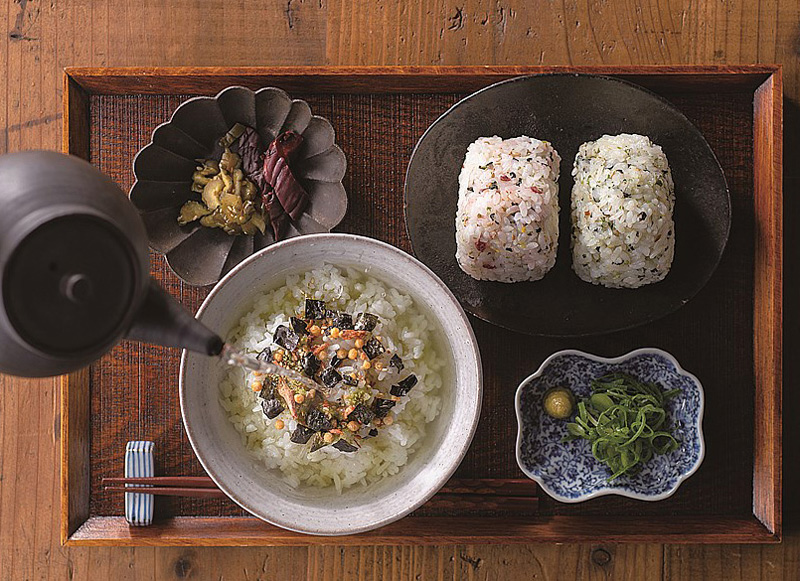
What are the coordinates of `tea pot` in the screenshot? It's located at (73, 297).